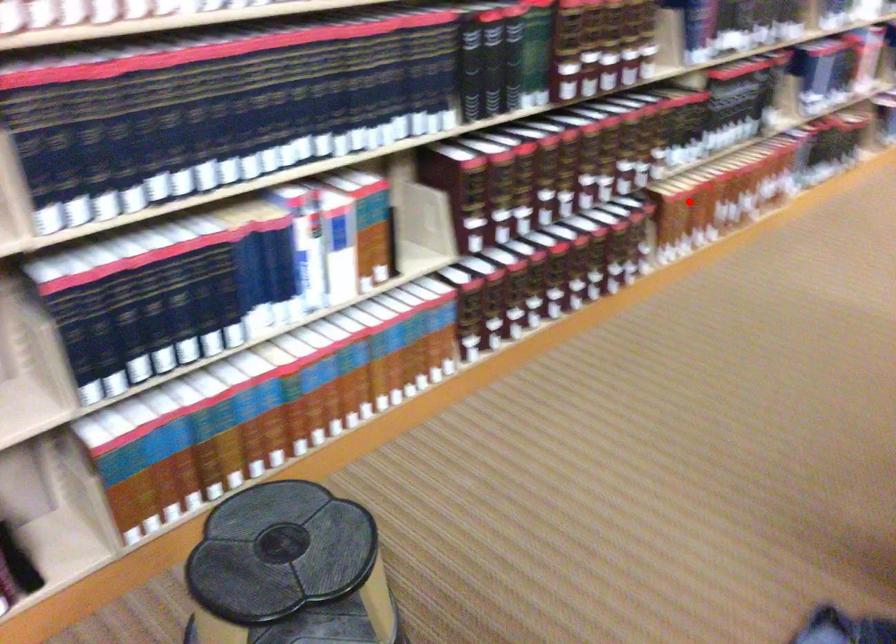
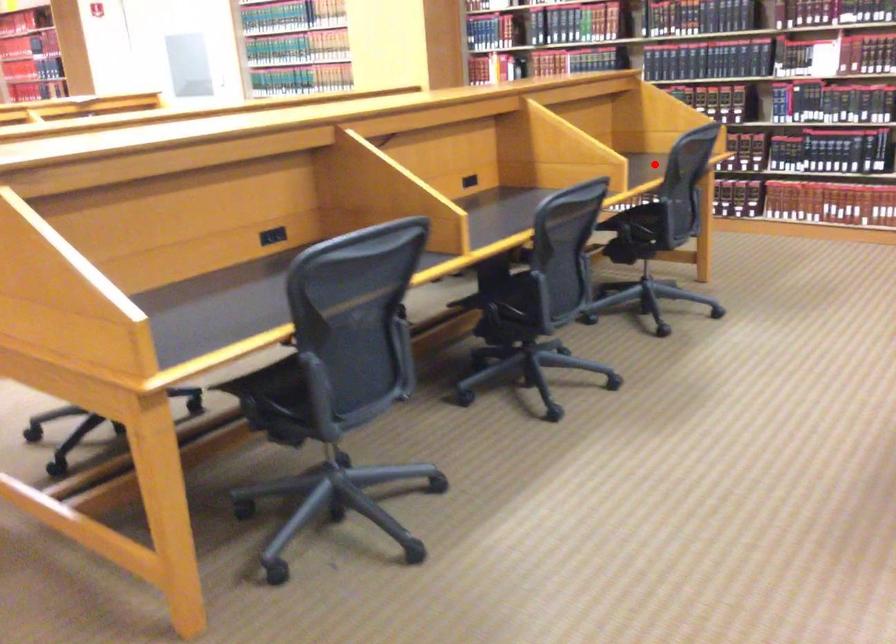
I am providing you with two images of the same scene from different viewpoints. A red point is marked on the first image and another point is marked on the second image. Does the point marked in image1 correspond to the same location as the one in image2?

No